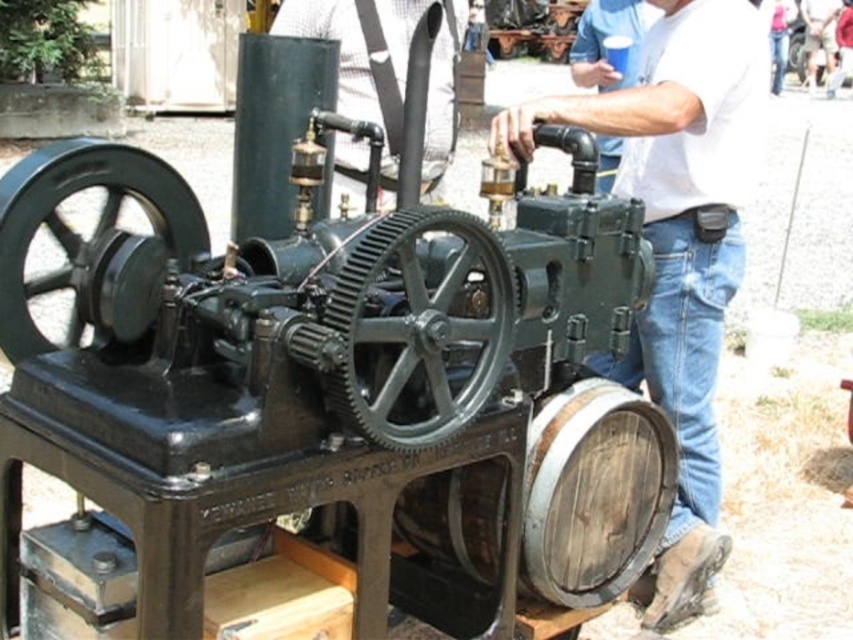
Question: Based on their relative distances, which object is nearer to the white matte cup at upper center?

Choices:
 (A) matte black tank at center
 (B) black cast iron steam engine at center
 (C) white matte shirt at upper center

Answer: (A)

Question: Which object appears closest to the camera in this image?

Choices:
 (A) white matte cup at upper center
 (B) black cast iron steam engine at center
 (C) white matte shirt at upper center
 (D) matte black tank at center

Answer: (B)

Question: Does black cast iron steam engine at center appear on the left side of white matte shirt at upper center?

Choices:
 (A) no
 (B) yes

Answer: (B)

Question: Does black cast iron steam engine at center appear on the right side of white matte shirt at upper center?

Choices:
 (A) yes
 (B) no

Answer: (B)

Question: Does white matte shirt at upper center lie in front of white matte cup at upper center?

Choices:
 (A) yes
 (B) no

Answer: (A)

Question: Estimate the real-world distances between objects in this image. Which object is closer to the black cast iron steam engine at center?

Choices:
 (A) white matte shirt at upper center
 (B) white matte cup at upper center

Answer: (A)